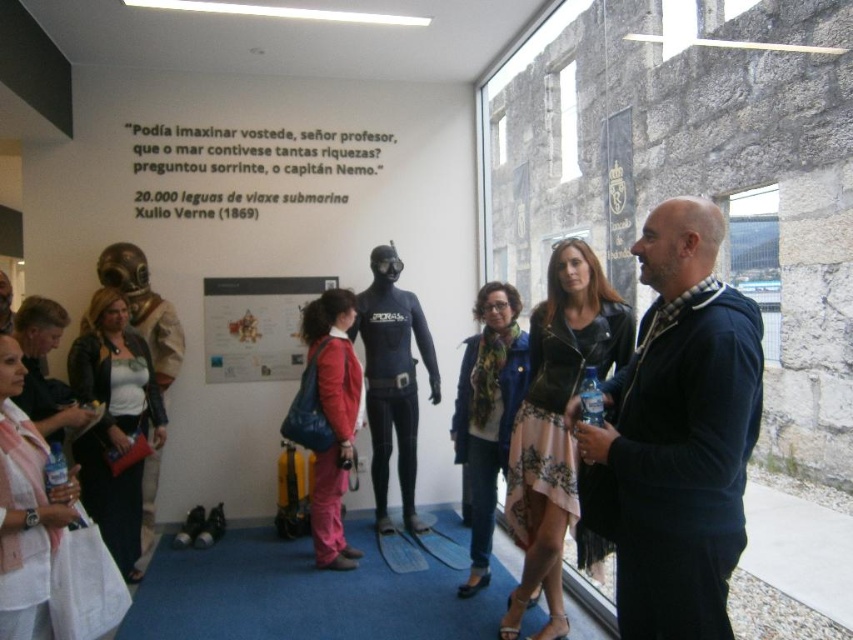
Is matte black jacket at center below matte black wetsuit at center?

Yes.

Between matte black jacket at center and matte black wetsuit at center, which one is positioned higher?

matte black wetsuit at center is above.

Measure the distance between matte black jacket at center and camera.

The distance of matte black jacket at center from camera is 3.52 meters.

The image size is (853, 640). In order to click on matte black jacket at center in this screenshot , I will do `click(115, 422)`.

You are a GUI agent. You are given a task and a screenshot of the screen. Output one action in this format:
    pyautogui.click(x=<x>, y=<y>)
    Task: Click on the matte black wetsuit at center
    
    Given the screenshot: What is the action you would take?
    pyautogui.click(x=392, y=380)

Which is more to the left, matte black wetsuit at center or matte red jacket at center?

matte red jacket at center is more to the left.

This screenshot has height=640, width=853. What are the coordinates of `matte black wetsuit at center` in the screenshot? It's located at (392, 380).

Does leather jacket at center have a lesser width compared to matte black wetsuit at center?

Yes.

Measure the distance between leather jacket at center and camera.

A distance of 8.85 feet exists between leather jacket at center and camera.

Between point (543, 589) and point (410, 336), which one is positioned behind?

The point (410, 336) is more distant.

Where is `leather jacket at center`? The image size is (853, 640). leather jacket at center is located at coordinates pos(556,422).